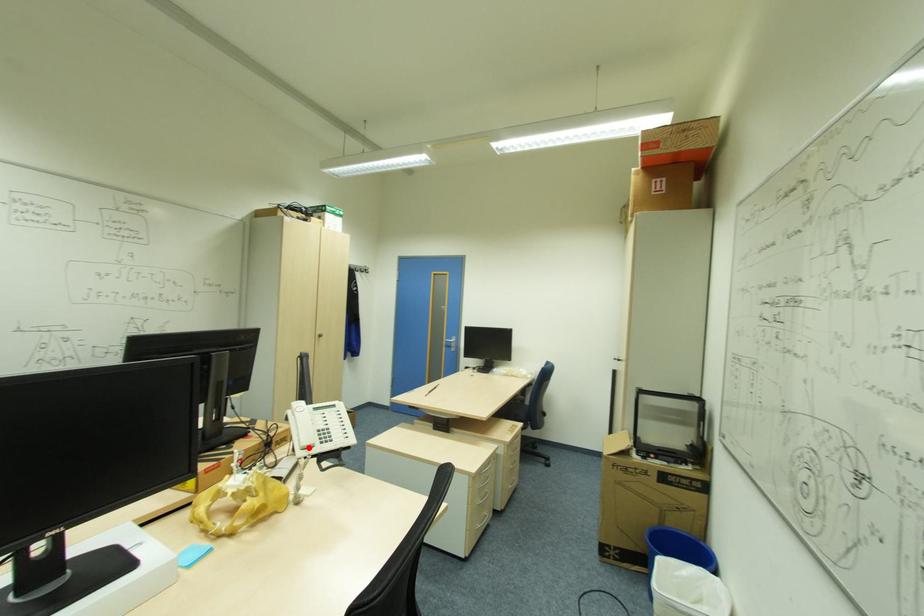
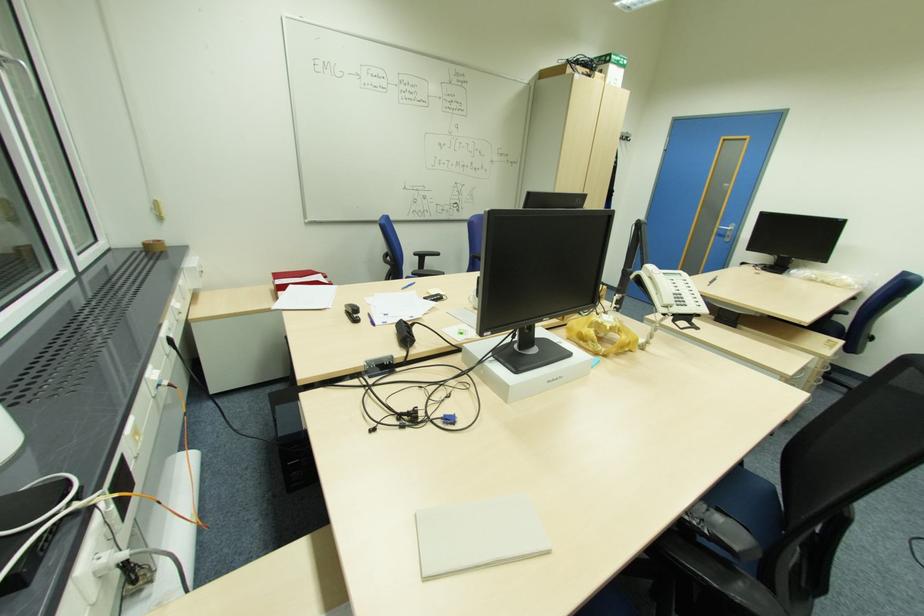
Question: A red point is marked in image1. In image2, is the corresponding 3D point closer to the camera or farther? Reply with the corresponding letter.

Choices:
 (A) The corresponding 3D point is closer.
 (B) The corresponding 3D point is farther.

Answer: (A)